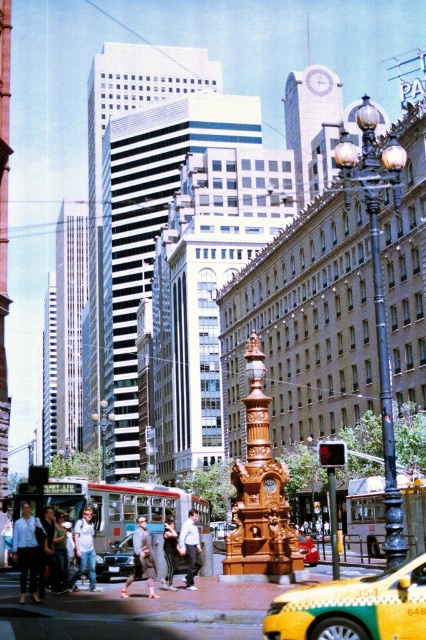
Who is lower down, yellow rubber taxi at center or light gray fabric coat at center?

Positioned lower is light gray fabric coat at center.

Which of these two, yellow rubber taxi at center or light gray fabric coat at center, stands taller?

With more height is yellow rubber taxi at center.

Between point (385, 593) and point (141, 531), which one is positioned behind?

Point (141, 531)

Image resolution: width=426 pixels, height=640 pixels. Identify the location of yellow rubber taxi at center. (354, 608).

Between point (192, 513) and point (275, 488), which one is positioned in front?

Point (275, 488) is in front.

Between point (187, 579) and point (271, 490), which one is positioned behind?

The point (271, 490) is more distant.

Find the location of a particular element. Image resolution: width=426 pixels, height=640 pixels. light blue shirt at center is located at coordinates (189, 547).

Who is more distant from viewer, (72, 576) or (316, 550)?

The point (316, 550) is more distant.

Is denim jeans at lower left taller than metallic red car at center?

In fact, denim jeans at lower left may be shorter than metallic red car at center.

Which is behind, point (75, 554) or point (302, 538)?

The point (302, 538) is behind.

Image resolution: width=426 pixels, height=640 pixels. I want to click on denim jeans at lower left, so click(x=85, y=548).